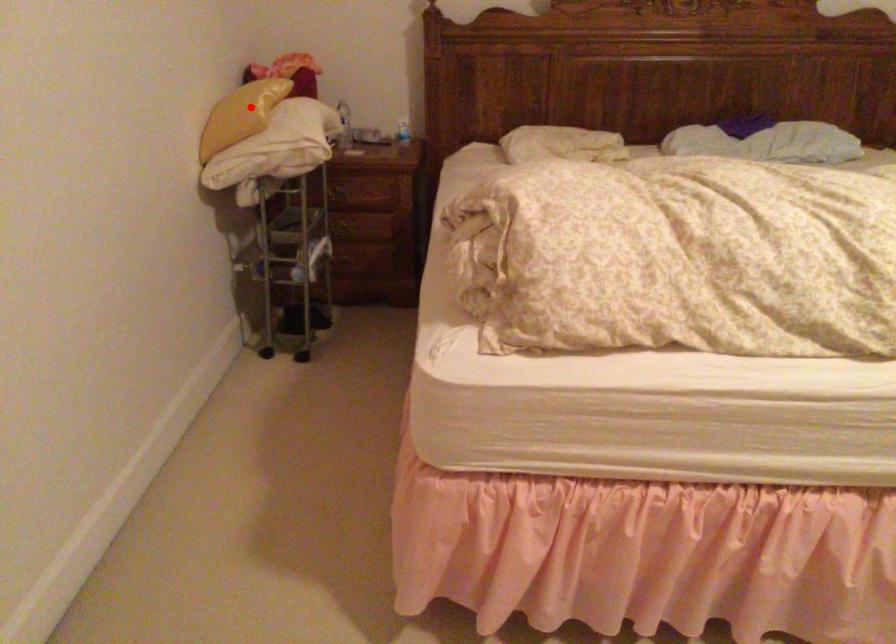
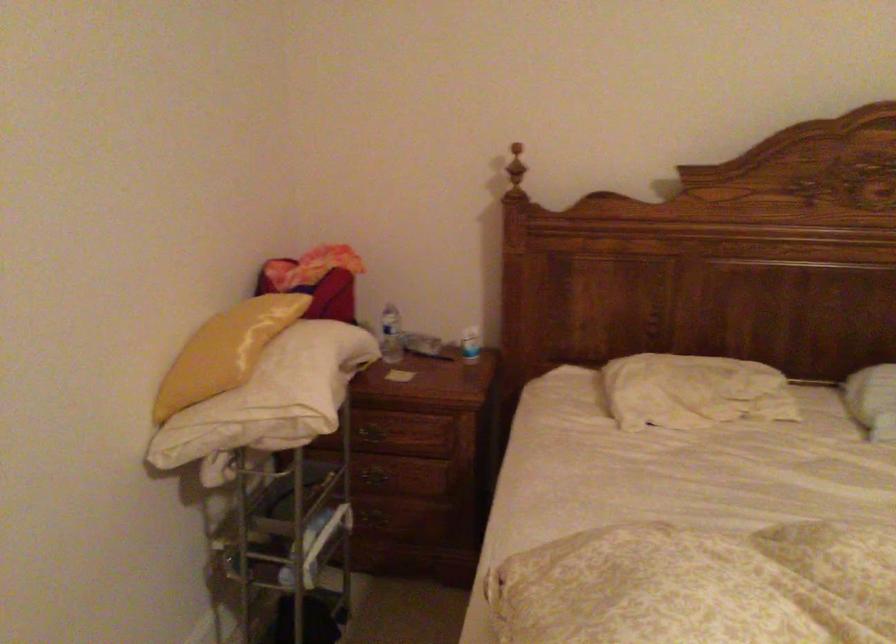
The point at the highlighted location is marked in the first image. Where is the corresponding point in the second image?

(225, 351)